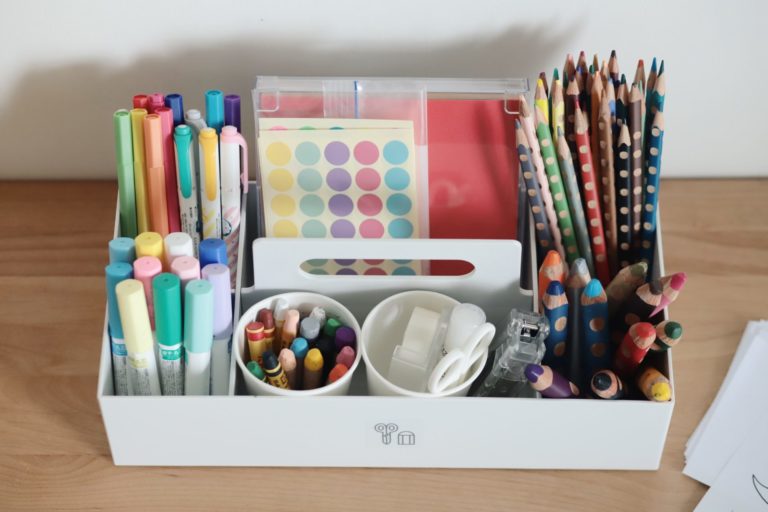
I want to click on pink sticker labels, so click(x=362, y=155), click(x=365, y=177), click(x=366, y=203), click(x=368, y=227), click(x=372, y=261), click(x=372, y=270).